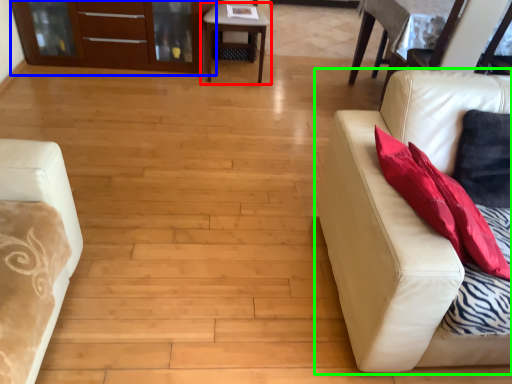
Question: Based on their relative distances, which object is farther from table (highlighted by a red box)? Choose from dresser (highlighted by a blue box) and studio couch (highlighted by a green box).

Choices:
 (A) dresser
 (B) studio couch

Answer: (B)